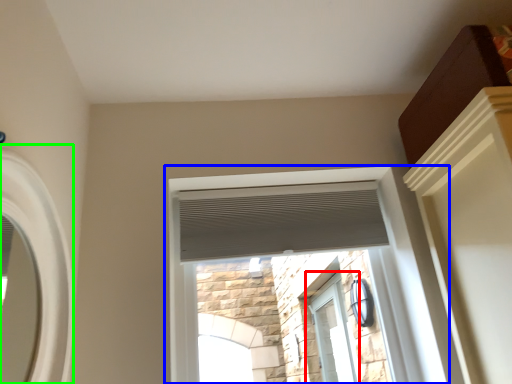
Question: Which object is the closest to the window (highlighted by a red box)? Choose among these: window (highlighted by a blue box) or window (highlighted by a green box).

Choices:
 (A) window
 (B) window

Answer: (A)